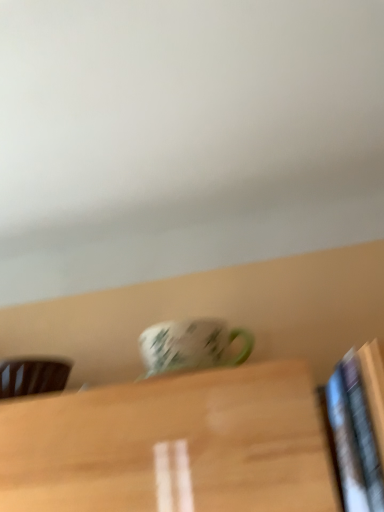
Locate an element on the screen. brown wood chair at left is located at coordinates (32, 376).

What do you see at coordinates (32, 376) in the screenshot? This screenshot has height=512, width=384. I see `brown wood chair at left` at bounding box center [32, 376].

This screenshot has height=512, width=384. What do you see at coordinates (191, 346) in the screenshot?
I see `green matte mug at center` at bounding box center [191, 346].

At what (x,y) coordinates should I click in order to perform the action: click on green matte mug at center. Please return your answer as a coordinate pair (x, y). This screenshot has width=384, height=512. Looking at the image, I should click on (191, 346).

Measure the distance between point (183, 348) and camera.

They are 96.20 centimeters apart.

I want to click on brown wood chair at left, so click(32, 376).

Does green matte mug at center appear on the left side of brown wood chair at left?

In fact, green matte mug at center is to the right of brown wood chair at left.

Between green matte mug at center and brown wood chair at left, which one is positioned in front?

Positioned in front is green matte mug at center.

Is point (161, 325) farther from viewer compared to point (40, 393)?

Yes.

From the image's perspective, is green matte mug at center over brown wood chair at left?

Yes.

From a real-world perspective, is green matte mug at center beneath brown wood chair at left?

Incorrect, from a real-world perspective, green matte mug at center is higher than brown wood chair at left.

Which of these two, green matte mug at center or brown wood chair at left, is thinner?

With smaller width is green matte mug at center.

Between green matte mug at center and brown wood chair at left, which one has less height?

With less height is brown wood chair at left.

Who is smaller, green matte mug at center or brown wood chair at left?

Smaller between the two is brown wood chair at left.

Is green matte mug at center not within brown wood chair at left?

Yes.

Would you consider green matte mug at center to be distant from brown wood chair at left?

Actually, green matte mug at center and brown wood chair at left are a little close together.

Is green matte mug at center positioned with its back to brown wood chair at left?

No.

Identify the location of coffee cup that appears above the brown wood chair at left (from a real-world perspective). (191, 346).

Which is more to the right, brown wood chair at left or green matte mug at center?

green matte mug at center.

Considering their positions, is brown wood chair at left located in front of or behind green matte mug at center?

Clearly, brown wood chair at left is behind green matte mug at center.

Does point (65, 364) appear closer or farther from the camera than point (150, 338)?

Point (65, 364) is positioned farther from the camera compared to point (150, 338).

From the image's perspective, which is below, brown wood chair at left or green matte mug at center?

brown wood chair at left, from the image's perspective.

In the scene shown: From a real-world perspective, between brown wood chair at left and green matte mug at center, who is vertically lower?

A: brown wood chair at left is physically lower.

Considering the sizes of objects brown wood chair at left and green matte mug at center in the image provided, who is thinner, brown wood chair at left or green matte mug at center?

green matte mug at center.

Is brown wood chair at left taller than green matte mug at center?

Incorrect, the height of brown wood chair at left is not larger of that of green matte mug at center.

Can you confirm if brown wood chair at left is smaller than green matte mug at center?

Correct, brown wood chair at left occupies less space than green matte mug at center.

Is brown wood chair at left not inside green matte mug at center?

Yes, brown wood chair at left is not within green matte mug at center.

Is brown wood chair at left next to green matte mug at center?

No, brown wood chair at left is not beside green matte mug at center.

Does brown wood chair at left turn towards green matte mug at center?

No, brown wood chair at left is not turned towards green matte mug at center.

How distant is brown wood chair at left from green matte mug at center?

brown wood chair at left is 13.24 inches from green matte mug at center.

Find the location of a particular element. The image size is (384, 512). coffee cup on the right of brown wood chair at left is located at coordinates (191, 346).

Locate an element on the screen. This screenshot has width=384, height=512. coffee cup that appears on the right of brown wood chair at left is located at coordinates (191, 346).

The height and width of the screenshot is (512, 384). What are the coordinates of `coffee cup that appears in front of the brown wood chair at left` in the screenshot? It's located at (191, 346).